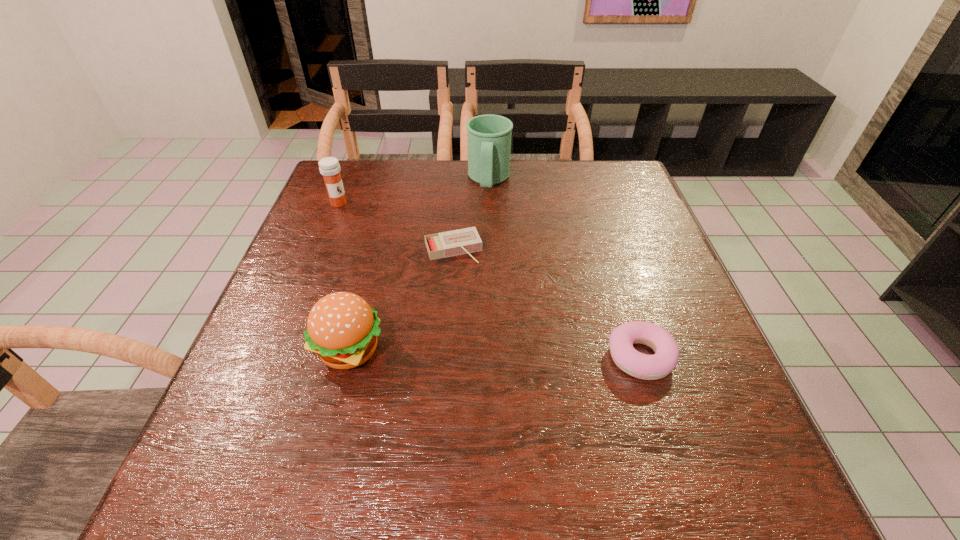
Identify the location of vacant spot on the desktop that is between the hamburger and the pastry and is positioned on the striking surface of the matchbox. (493, 353).

Where is `free space on the desktop that is between the second object from left to right and the rightmost object and is positioned on the label side of the leftmost object`? The width and height of the screenshot is (960, 540). free space on the desktop that is between the second object from left to right and the rightmost object and is positioned on the label side of the leftmost object is located at coordinates (507, 354).

This screenshot has width=960, height=540. Find the location of `free space on the desktop that is between the hamburger and the rightmost object and is positioned on the side of the tallest object with the handle`. free space on the desktop that is between the hamburger and the rightmost object and is positioned on the side of the tallest object with the handle is located at coordinates (468, 353).